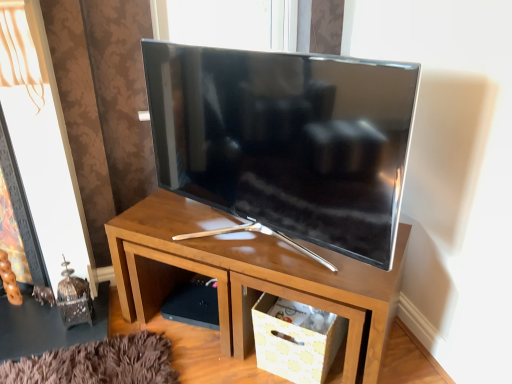
Where is `wooden tv stand at center`? wooden tv stand at center is located at coordinates (247, 275).

In order to face satin black tv at center, should I rotate leftwards or rightwards?

You should rotate left by 4.312 degrees.

Identify the location of wooden tv stand at center. This screenshot has height=384, width=512. (247, 275).

Does point (251, 187) come in front of point (316, 250)?

Yes, it is.

Does satin black tv at center have a greater width compared to wooden tv stand at center?

No.

From the image's perspective, which is above, satin black tv at center or wooden tv stand at center?

satin black tv at center appears higher in the image.

Find the location of `desk below the satin black tv at center (from a real-world perspective)`. desk below the satin black tv at center (from a real-world perspective) is located at coordinates (247, 275).

In the image, is wooden tv stand at center on the left side or the right side of satin black tv at center?

In the image, wooden tv stand at center appears on the right side of satin black tv at center.

Can you confirm if wooden tv stand at center is thinner than satin black tv at center?

No, wooden tv stand at center is not thinner than satin black tv at center.

From a real-world perspective, is wooden tv stand at center beneath satin black tv at center?

Yes, from a real-world perspective, wooden tv stand at center is below satin black tv at center.

From a real-world perspective, which object rests below the other?

From a 3D spatial view, white paper storage box at lower right is below.

Considering the relative sizes of white paper storage box at lower right and satin black tv at center in the image provided, is white paper storage box at lower right taller than satin black tv at center?

No.

Is white paper storage box at lower right not inside satin black tv at center?

That's correct, white paper storage box at lower right is outside of satin black tv at center.

Considering the points (254, 311) and (177, 56), which point is in front, point (254, 311) or point (177, 56)?

Positioned in front is point (177, 56).

Considering the relative positions of satin black tv at center and white paper storage box at lower right in the image provided, is satin black tv at center to the left of white paper storage box at lower right from the viewer's perspective?

Indeed, satin black tv at center is positioned on the left side of white paper storage box at lower right.

At what (x,y) coordinates should I click in order to perform the action: click on television in front of the white paper storage box at lower right. Please return your answer as a coordinate pair (x, y). This screenshot has height=384, width=512. Looking at the image, I should click on (286, 140).

Considering the relative sizes of satin black tv at center and white paper storage box at lower right in the image provided, is satin black tv at center taller than white paper storage box at lower right?

Indeed, satin black tv at center has a greater height compared to white paper storage box at lower right.

Which object is closer to the camera, white paper storage box at lower right or wooden tv stand at center?

wooden tv stand at center is closer to the camera.

Between white paper storage box at lower right and wooden tv stand at center, which one has more height?

With more height is wooden tv stand at center.

Considering the sizes of white paper storage box at lower right and wooden tv stand at center in the image, is white paper storage box at lower right bigger or smaller than wooden tv stand at center?

In the image, white paper storage box at lower right appears to be smaller than wooden tv stand at center.

Who is taller, wooden tv stand at center or white paper storage box at lower right?

wooden tv stand at center is taller.

Does wooden tv stand at center have a smaller size compared to white paper storage box at lower right?

No.

Find the location of a particular element. The height and width of the screenshot is (384, 512). storage box on the right side of wooden tv stand at center is located at coordinates (296, 339).

From a real-world perspective, is wooden tv stand at center under white paper storage box at lower right?

No, from a real-world perspective, wooden tv stand at center is not beneath white paper storage box at lower right.

I want to click on desk below the satin black tv at center (from the image's perspective), so click(x=247, y=275).

Find the location of `desk behind the satin black tv at center`. desk behind the satin black tv at center is located at coordinates (247, 275).

From the image, which object appears to be farther from wooden tv stand at center, satin black tv at center or white paper storage box at lower right?

The object further to wooden tv stand at center is satin black tv at center.

Which object lies further to the anchor point satin black tv at center, wooden tv stand at center or white paper storage box at lower right?

white paper storage box at lower right is further to satin black tv at center.

Considering their positions, is white paper storage box at lower right positioned closer to satin black tv at center than wooden tv stand at center?

Based on the image, wooden tv stand at center appears to be nearer to satin black tv at center.

Considering their positions, is wooden tv stand at center positioned further to white paper storage box at lower right than satin black tv at center?

satin black tv at center is further to white paper storage box at lower right.

When comparing their distances from white paper storage box at lower right, does satin black tv at center or wooden tv stand at center seem closer?

wooden tv stand at center lies closer to white paper storage box at lower right than the other object.

Which object lies nearer to the anchor point wooden tv stand at center, white paper storage box at lower right or satin black tv at center?

The object closer to wooden tv stand at center is white paper storage box at lower right.

I want to click on desk that lies between satin black tv at center and white paper storage box at lower right from top to bottom, so [x=247, y=275].